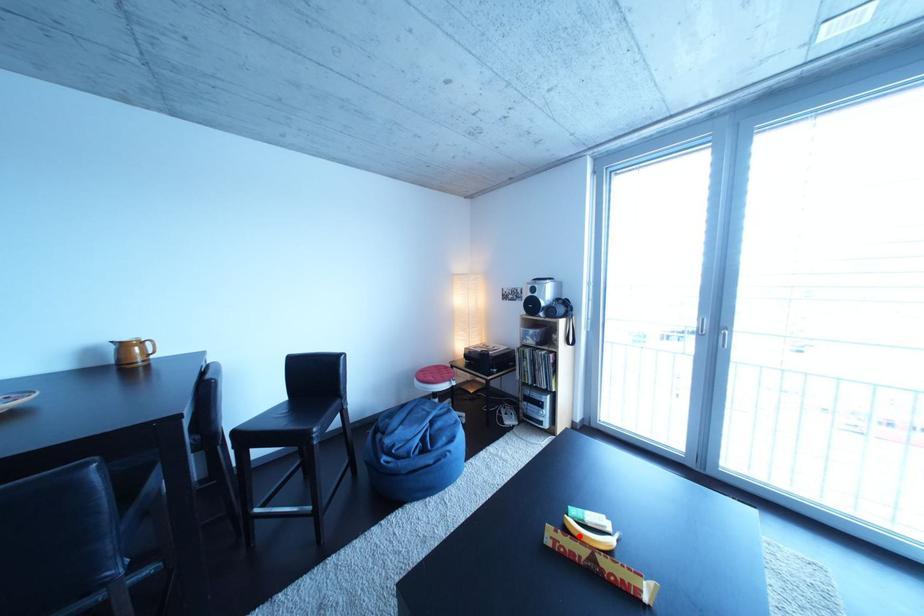
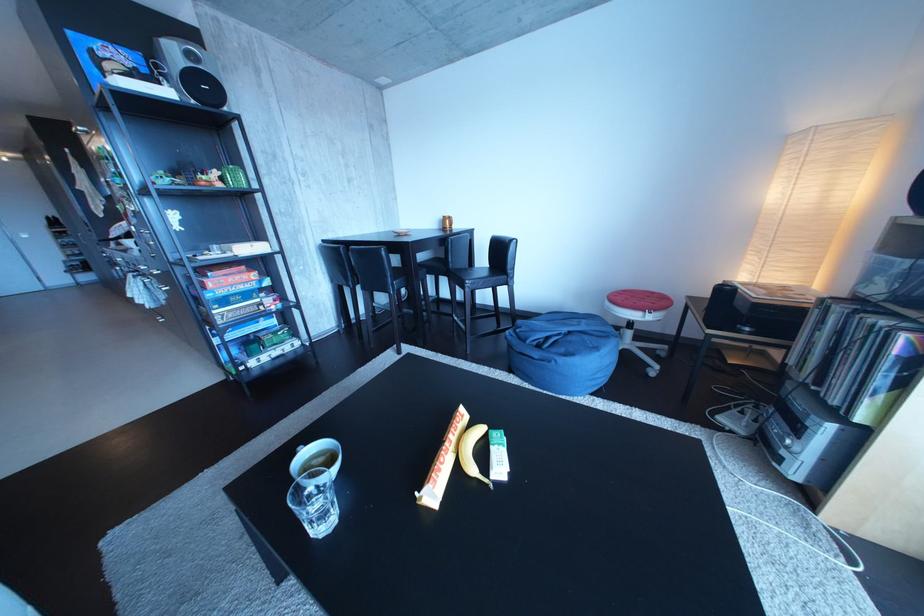
Find the pixel in the second image that matches the highlighted location in the first image.

(479, 430)